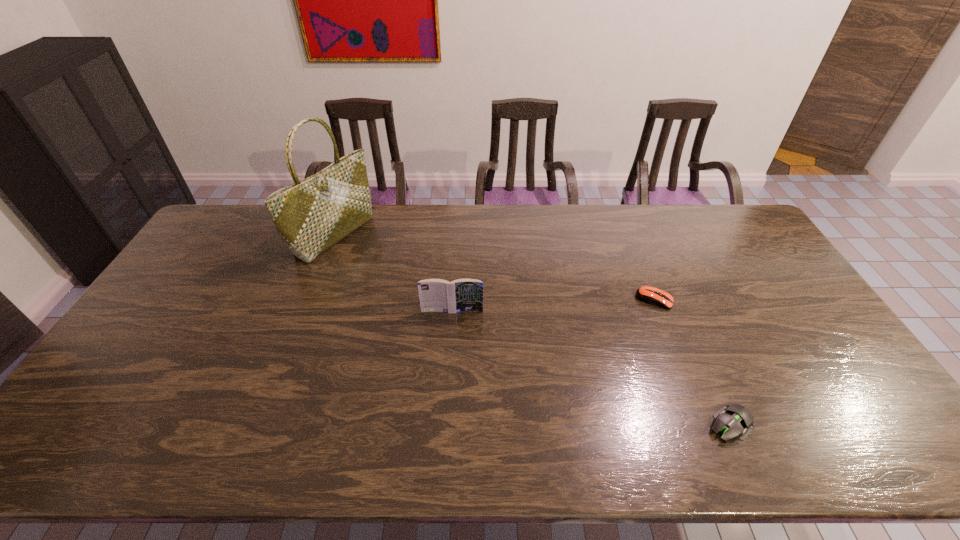
This screenshot has width=960, height=540. What are the coordinates of `vacant area that lies between the nearest object and the farthest object` in the screenshot? It's located at (533, 330).

At what (x,y) coordinates should I click in order to perform the action: click on free space between the nearer computer mouse and the third object from right to left. Please return your answer as a coordinate pair (x, y). Looking at the image, I should click on (591, 368).

Find the location of a particular element. Image resolution: width=960 pixels, height=540 pixels. free space between the shopping bag and the third shortest object is located at coordinates (394, 273).

Where is `vacant space in between the farthest object and the nearest object`? Image resolution: width=960 pixels, height=540 pixels. vacant space in between the farthest object and the nearest object is located at coordinates (533, 330).

The height and width of the screenshot is (540, 960). Find the location of `free space between the shopping bag and the nearest object`. free space between the shopping bag and the nearest object is located at coordinates (533, 330).

The width and height of the screenshot is (960, 540). Identify the location of free point between the farthest object and the nearer computer mouse. (533, 330).

You are a GUI agent. You are given a task and a screenshot of the screen. Output one action in this format:
    pyautogui.click(x=<x>, y=<y>)
    Task: Click on the free area in between the shopping bag and the nearer computer mouse
    The height and width of the screenshot is (540, 960).
    Given the screenshot: What is the action you would take?
    pyautogui.click(x=533, y=330)

Locate an element on the screen. The height and width of the screenshot is (540, 960). vacant space in between the third shortest object and the farther computer mouse is located at coordinates (554, 305).

Point out which object is positioned as the second nearest to the third shortest object. Please provide its 2D coordinates. Your answer should be formatted as a tuple, i.e. [(x, y)], where the tuple contains the x and y coordinates of a point satisfying the conditions above.

[(647, 294)]

Where is `the closest object to the farther computer mouse`? the closest object to the farther computer mouse is located at coordinates (734, 420).